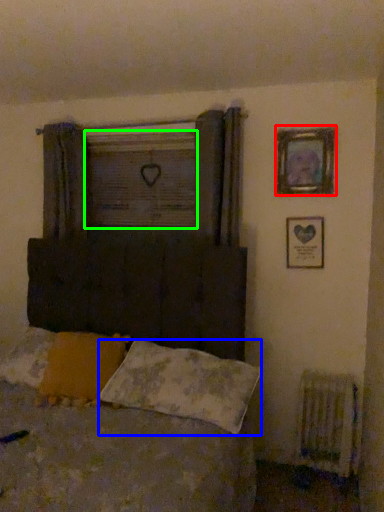
Question: Which object is the closest to the picture frame (highlighted by a red box)? Choose among these: pillow (highlighted by a blue box) or window screen (highlighted by a green box).

Choices:
 (A) pillow
 (B) window screen

Answer: (B)